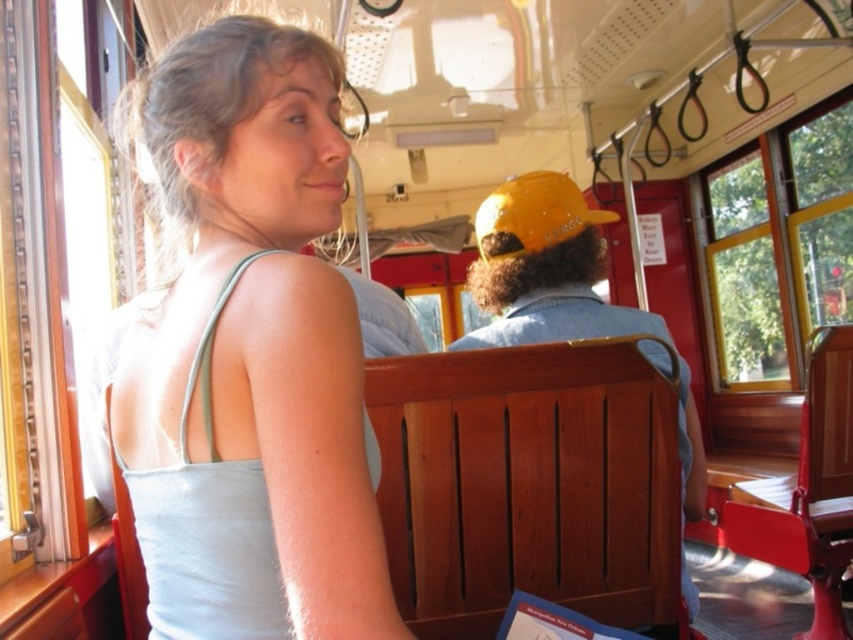
In the scene shown: Does white matte tank top at upper left have a lesser height compared to wooden bench at center?

Correct, white matte tank top at upper left is not as tall as wooden bench at center.

Is point (184, 506) in front of point (643, 332)?

Yes, point (184, 506) is closer to viewer.

Where is `white matte tank top at upper left`? white matte tank top at upper left is located at coordinates (251, 356).